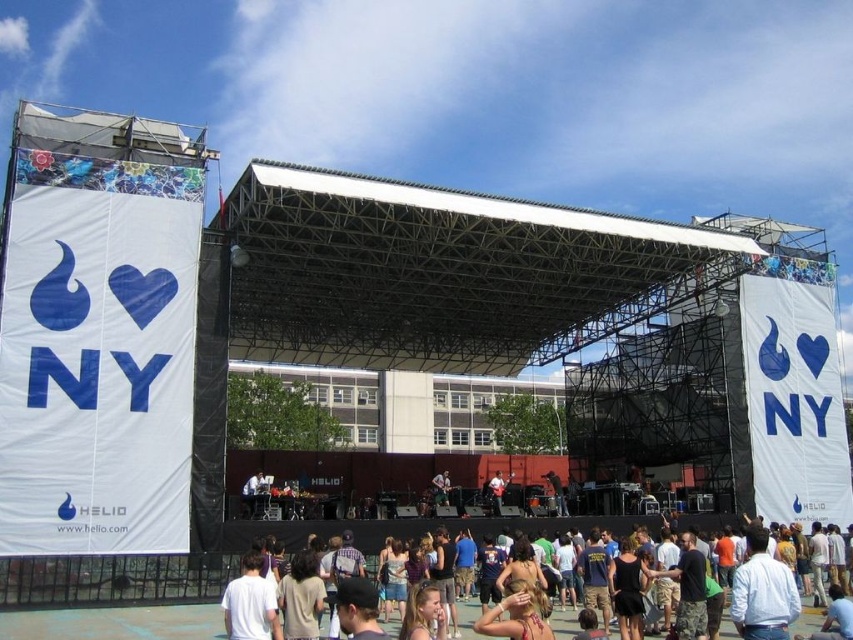
Question: Estimate the real-world distances between objects in this image. Which object is farther from the white cotton t-shirt at lower center?

Choices:
 (A) shiny black guitar at center
 (B) white fabric shirt at center

Answer: (B)

Question: Which point is closer to the camera taking this photo?

Choices:
 (A) (805, 612)
 (B) (231, 614)
 (C) (491, 492)

Answer: (B)

Question: In this image, where is white cotton t-shirt at lower center located relative to white fabric shirt at center?

Choices:
 (A) right
 (B) left

Answer: (B)

Question: Which object is farther from the camera taking this photo?

Choices:
 (A) white cotton t-shirt at lower center
 (B) shiny black guitar at center
 (C) white fabric shirt at center

Answer: (B)

Question: Is white cotton t-shirt at lower center above white fabric shirt at center?

Choices:
 (A) no
 (B) yes

Answer: (B)

Question: Can you confirm if white cotton shirt at lower center is positioned to the right of shiny black guitar at center?

Choices:
 (A) yes
 (B) no

Answer: (A)